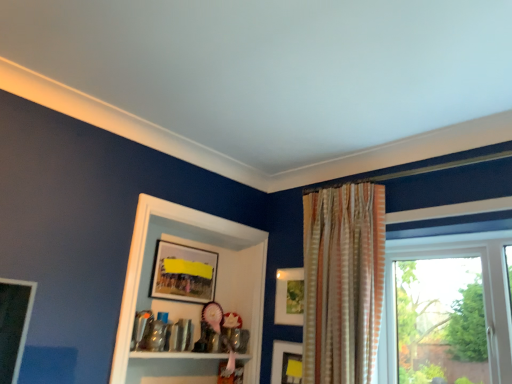
I want to click on matte white picture frame at center, the third picture frame from the left, so click(x=289, y=297).

Where is `matte wooden picture frame at upper center, which is the 4th picture frame from right to left`? matte wooden picture frame at upper center, which is the 4th picture frame from right to left is located at coordinates (183, 273).

What do you see at coordinates (291, 368) in the screenshot? This screenshot has width=512, height=384. I see `matte yellow picture frame at lower right, marked as the first picture frame in a right-to-left arrangement` at bounding box center [291, 368].

This screenshot has height=384, width=512. What do you see at coordinates (343, 282) in the screenshot? I see `striped fabric curtain at upper right` at bounding box center [343, 282].

The width and height of the screenshot is (512, 384). Find the location of `white glossy cabinet at center`. white glossy cabinet at center is located at coordinates (190, 304).

Where is `matte white picture frame at center, the third picture frame from the left`? This screenshot has width=512, height=384. matte white picture frame at center, the third picture frame from the left is located at coordinates (289, 297).

From the image's perspective, is matte wooden picture frame at upper center, which is the first picture frame in left-to-right order, above or below matte white picture frame at center, placed as the second picture frame when sorted from right to left?

matte wooden picture frame at upper center, which is the first picture frame in left-to-right order, is situated higher than matte white picture frame at center, placed as the second picture frame when sorted from right to left, in the image.

Considering the sizes of objects matte wooden picture frame at upper center, which is the 4th picture frame from right to left, and matte white picture frame at center, the third picture frame from the left, in the image provided, who is shorter, matte wooden picture frame at upper center, which is the 4th picture frame from right to left, or matte white picture frame at center, the third picture frame from the left,?

With less height is matte wooden picture frame at upper center, which is the 4th picture frame from right to left.

What's the angular difference between matte wooden picture frame at upper center, which is the first picture frame in left-to-right order, and matte white picture frame at center, the third picture frame from the left,'s facing directions?

The facing directions of matte wooden picture frame at upper center, which is the first picture frame in left-to-right order, and matte white picture frame at center, the third picture frame from the left, are 84.8 degrees apart.

Is matte yellow picture frame at lower right, marked as the first picture frame in a right-to-left arrangement, surrounded by striped fabric curtain at upper right?

No, matte yellow picture frame at lower right, marked as the first picture frame in a right-to-left arrangement, is not a part of striped fabric curtain at upper right.

From the image's perspective, is striped fabric curtain at upper right positioned above or below matte yellow picture frame at lower right, marked as the first picture frame in a right-to-left arrangement?

striped fabric curtain at upper right is situated higher than matte yellow picture frame at lower right, marked as the first picture frame in a right-to-left arrangement, in the image.

In terms of size, does striped fabric curtain at upper right appear bigger or smaller than matte yellow picture frame at lower right, marked as the first picture frame in a right-to-left arrangement?

Considering their sizes, striped fabric curtain at upper right takes up more space than matte yellow picture frame at lower right, marked as the first picture frame in a right-to-left arrangement.

From a real-world perspective, between striped fabric curtain at upper right and matte yellow picture frame at lower right, the 4th picture frame positioned from the left, who is vertically higher?

striped fabric curtain at upper right, from a real-world perspective.

Considering the points (291, 361) and (290, 379), which point is in front, point (291, 361) or point (290, 379)?

The point (290, 379) is closer to the camera.

From the image's perspective, who appears lower, matte yellow picture frame at lower right, the 4th picture frame positioned from the left, or wooden picture frame at center, placed as the 3th picture frame when sorted from right to left?

From the image's view, wooden picture frame at center, placed as the 3th picture frame when sorted from right to left, is below.

Is matte yellow picture frame at lower right, the 4th picture frame positioned from the left, located outside wooden picture frame at center, placed as the 3th picture frame when sorted from right to left?

No, matte yellow picture frame at lower right, the 4th picture frame positioned from the left, is not entirely external to wooden picture frame at center, placed as the 3th picture frame when sorted from right to left.

Could you measure the distance between matte yellow picture frame at lower right, marked as the first picture frame in a right-to-left arrangement, and wooden picture frame at center, placed as the 2th picture frame when sorted from left to right?

A distance of 0.71 inches exists between matte yellow picture frame at lower right, marked as the first picture frame in a right-to-left arrangement, and wooden picture frame at center, placed as the 2th picture frame when sorted from left to right.

How many degrees apart are the facing directions of white glossy cabinet at center and striped fabric curtain at upper right?

The facing directions of white glossy cabinet at center and striped fabric curtain at upper right are 88.4 degrees apart.

In terms of height, does white glossy cabinet at center look taller or shorter compared to striped fabric curtain at upper right?

white glossy cabinet at center is shorter than striped fabric curtain at upper right.

From a real-world perspective, is white glossy cabinet at center positioned under striped fabric curtain at upper right based on gravity?

Yes, from a real-world perspective, white glossy cabinet at center is below striped fabric curtain at upper right.

In terms of size, does matte white picture frame at center, the third picture frame from the left, appear bigger or smaller than matte yellow picture frame at lower right, the 4th picture frame positioned from the left?

Clearly, matte white picture frame at center, the third picture frame from the left, is larger in size than matte yellow picture frame at lower right, the 4th picture frame positioned from the left.

Considering the relative positions of matte white picture frame at center, the third picture frame from the left, and matte yellow picture frame at lower right, marked as the first picture frame in a right-to-left arrangement, in the image provided, is matte white picture frame at center, the third picture frame from the left, to the left or to the right of matte yellow picture frame at lower right, marked as the first picture frame in a right-to-left arrangement,?

matte white picture frame at center, the third picture frame from the left, is positioned on matte yellow picture frame at lower right, marked as the first picture frame in a right-to-left arrangement,'s left side.

Measure the distance from matte white picture frame at center, placed as the second picture frame when sorted from right to left, to matte yellow picture frame at lower right, marked as the first picture frame in a right-to-left arrangement.

matte white picture frame at center, placed as the second picture frame when sorted from right to left, is 11.07 inches from matte yellow picture frame at lower right, marked as the first picture frame in a right-to-left arrangement.

Is matte white picture frame at center, placed as the second picture frame when sorted from right to left, shorter than matte yellow picture frame at lower right, marked as the first picture frame in a right-to-left arrangement?

In fact, matte white picture frame at center, placed as the second picture frame when sorted from right to left, may be taller than matte yellow picture frame at lower right, marked as the first picture frame in a right-to-left arrangement.

Looking at this image, is wooden picture frame at center, placed as the 3th picture frame when sorted from right to left, positioned with its back to striped fabric curtain at upper right?

wooden picture frame at center, placed as the 3th picture frame when sorted from right to left, is not turned away from striped fabric curtain at upper right.

From the image's perspective, does wooden picture frame at center, placed as the 2th picture frame when sorted from left to right, appear lower than striped fabric curtain at upper right?

Yes, from the image's perspective, wooden picture frame at center, placed as the 2th picture frame when sorted from left to right, is below striped fabric curtain at upper right.

From a real-world perspective, which is physically below, wooden picture frame at center, placed as the 2th picture frame when sorted from left to right, or striped fabric curtain at upper right?

wooden picture frame at center, placed as the 2th picture frame when sorted from left to right, is physically lower.

Consider the image. Is wooden picture frame at center, placed as the 2th picture frame when sorted from left to right, not near striped fabric curtain at upper right?

They are positioned close to each other.

Is matte wooden picture frame at upper center, which is the 4th picture frame from right to left, situated inside matte yellow picture frame at lower right, the 4th picture frame positioned from the left, or outside?

The correct answer is: outside.

Considering the relative sizes of matte wooden picture frame at upper center, which is the 4th picture frame from right to left, and matte yellow picture frame at lower right, marked as the first picture frame in a right-to-left arrangement, in the image provided, is matte wooden picture frame at upper center, which is the 4th picture frame from right to left, taller than matte yellow picture frame at lower right, marked as the first picture frame in a right-to-left arrangement,?

Indeed, matte wooden picture frame at upper center, which is the 4th picture frame from right to left, has a greater height compared to matte yellow picture frame at lower right, marked as the first picture frame in a right-to-left arrangement.

Considering the sizes of objects matte wooden picture frame at upper center, which is the first picture frame in left-to-right order, and matte yellow picture frame at lower right, marked as the first picture frame in a right-to-left arrangement, in the image provided, who is thinner, matte wooden picture frame at upper center, which is the first picture frame in left-to-right order, or matte yellow picture frame at lower right, marked as the first picture frame in a right-to-left arrangement,?

matte yellow picture frame at lower right, marked as the first picture frame in a right-to-left arrangement.

Could you tell me if matte wooden picture frame at upper center, which is the first picture frame in left-to-right order, is turned towards matte yellow picture frame at lower right, the 4th picture frame positioned from the left?

No, matte wooden picture frame at upper center, which is the first picture frame in left-to-right order, is not turned towards matte yellow picture frame at lower right, the 4th picture frame positioned from the left.

Locate an element on the screen. picture frame that is behind the matte wooden picture frame at upper center, which is the first picture frame in left-to-right order is located at coordinates (289, 297).

I want to click on the 2nd picture frame below the striped fabric curtain at upper right (from a real-world perspective), so click(x=291, y=368).

When comparing their distances from white glossy cabinet at center, does striped fabric curtain at upper right or matte wooden picture frame at upper center, which is the first picture frame in left-to-right order, seem further?

Among the two, striped fabric curtain at upper right is located further to white glossy cabinet at center.

Looking at the image, which one is located closer to matte white picture frame at center, placed as the second picture frame when sorted from right to left, matte wooden picture frame at upper center, which is the 4th picture frame from right to left, or white glossy cabinet at center?

Based on the image, white glossy cabinet at center appears to be nearer to matte white picture frame at center, placed as the second picture frame when sorted from right to left.

Looking at the image, which one is located further to matte wooden picture frame at upper center, which is the 4th picture frame from right to left, white glossy cabinet at center or wooden picture frame at center, placed as the 3th picture frame when sorted from right to left?

wooden picture frame at center, placed as the 3th picture frame when sorted from right to left, lies further to matte wooden picture frame at upper center, which is the 4th picture frame from right to left, than the other object.

Based on their spatial positions, is matte yellow picture frame at lower right, marked as the first picture frame in a right-to-left arrangement, or wooden picture frame at center, placed as the 3th picture frame when sorted from right to left, further from matte wooden picture frame at upper center, which is the first picture frame in left-to-right order?

matte yellow picture frame at lower right, marked as the first picture frame in a right-to-left arrangement, is further to matte wooden picture frame at upper center, which is the first picture frame in left-to-right order.

From the image, which object appears to be nearer to striped fabric curtain at upper right, matte wooden picture frame at upper center, which is the first picture frame in left-to-right order, or wooden picture frame at center, placed as the 3th picture frame when sorted from right to left?

Among the two, wooden picture frame at center, placed as the 3th picture frame when sorted from right to left, is located nearer to striped fabric curtain at upper right.

Based on their spatial positions, is striped fabric curtain at upper right or white glossy cabinet at center further from wooden picture frame at center, placed as the 2th picture frame when sorted from left to right?

Among the two, white glossy cabinet at center is located further to wooden picture frame at center, placed as the 2th picture frame when sorted from left to right.

Looking at the image, which one is located closer to wooden picture frame at center, placed as the 3th picture frame when sorted from right to left, matte white picture frame at center, placed as the second picture frame when sorted from right to left, or white glossy cabinet at center?

matte white picture frame at center, placed as the second picture frame when sorted from right to left, is closer to wooden picture frame at center, placed as the 3th picture frame when sorted from right to left.

From the image, which object appears to be nearer to matte yellow picture frame at lower right, the 4th picture frame positioned from the left, wooden picture frame at center, placed as the 3th picture frame when sorted from right to left, or matte white picture frame at center, placed as the second picture frame when sorted from right to left?

wooden picture frame at center, placed as the 3th picture frame when sorted from right to left.

I want to click on cabinet between matte wooden picture frame at upper center, which is the 4th picture frame from right to left, and matte yellow picture frame at lower right, the 4th picture frame positioned from the left, from left to right, so 190,304.

Find the location of a particular element. picture frame between matte wooden picture frame at upper center, which is the 4th picture frame from right to left, and matte white picture frame at center, the third picture frame from the left, from left to right is located at coordinates (286, 363).

Where is `cabinet between matte wooden picture frame at upper center, which is the 4th picture frame from right to left, and matte white picture frame at center, placed as the second picture frame when sorted from right to left, in the horizontal direction`? This screenshot has width=512, height=384. cabinet between matte wooden picture frame at upper center, which is the 4th picture frame from right to left, and matte white picture frame at center, placed as the second picture frame when sorted from right to left, in the horizontal direction is located at coordinates (190, 304).

Where is `cabinet between matte wooden picture frame at upper center, which is the first picture frame in left-to-right order, and wooden picture frame at center, placed as the 2th picture frame when sorted from left to right`? Image resolution: width=512 pixels, height=384 pixels. cabinet between matte wooden picture frame at upper center, which is the first picture frame in left-to-right order, and wooden picture frame at center, placed as the 2th picture frame when sorted from left to right is located at coordinates (190, 304).